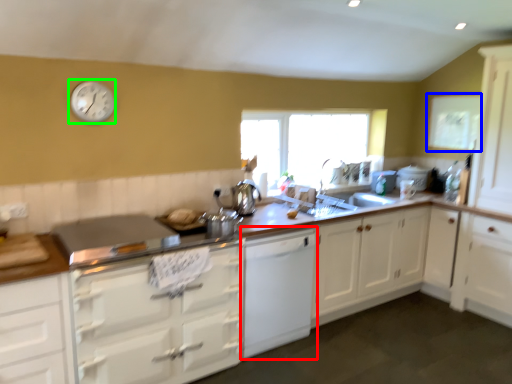
Question: Which object is the farthest from cabinetry (highlighted by a red box)? Choose among these: window screen (highlighted by a blue box) or clock (highlighted by a green box).

Choices:
 (A) window screen
 (B) clock

Answer: (A)